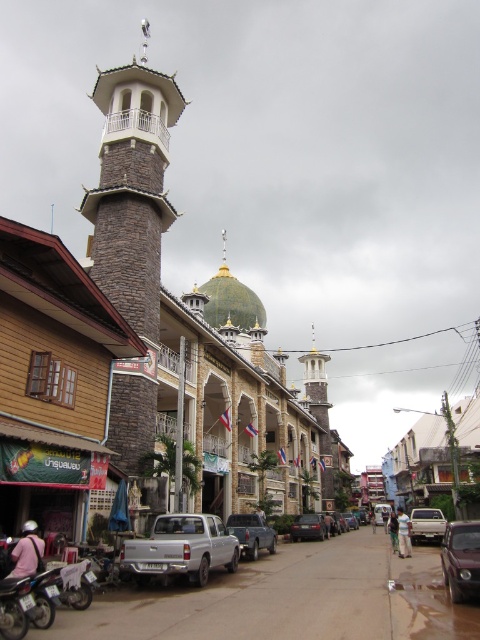
Question: Is matte black motorcycle at lower left wider than shiny black sedan at center?

Choices:
 (A) yes
 (B) no

Answer: (B)

Question: Which of the following is the farthest from the observer?

Choices:
 (A) light blue fabric at center
 (B) light pink fabric helmet at lower left
 (C) white fabric shirt at center
 (D) matte black motorcycle at lower left

Answer: (C)

Question: Considering the relative positions of metallic silver pickup truck at center and shiny black sedan at center in the image provided, where is metallic silver pickup truck at center located with respect to shiny black sedan at center?

Choices:
 (A) above
 (B) below

Answer: (A)

Question: Estimate the real-world distances between objects in this image. Which object is farther from the white fabric shirt at center?

Choices:
 (A) shiny dark brown car at lower right
 (B) metallic silver pickup truck at center
 (C) matte silver truck at center

Answer: (A)

Question: Estimate the real-world distances between objects in this image. Which object is farther from the shiny dark brown car at lower right?

Choices:
 (A) light pink fabric helmet at lower left
 (B) metallic silver pickup truck at center
 (C) white fabric shirt at center
 (D) light blue fabric at center

Answer: (C)

Question: From the image, what is the correct spatial relationship of matte silver truck at center in relation to light blue fabric at center?

Choices:
 (A) below
 (B) above

Answer: (B)